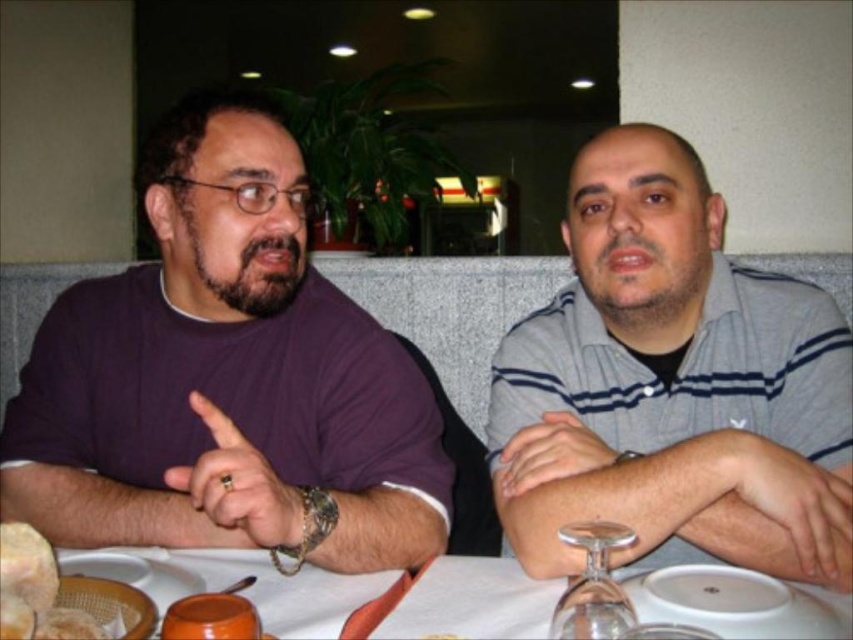
Question: Which point appears closest to the camera in this image?

Choices:
 (A) (273, 428)
 (B) (585, 616)

Answer: (B)

Question: Does purple matte shirt at left appear on the left side of transparent glass wine glass at lower center?

Choices:
 (A) yes
 (B) no

Answer: (A)

Question: Considering the real-world distances, which object is farthest from the transparent glass wine glass at lower center?

Choices:
 (A) white glossy table at lower center
 (B) bread soft at lower left

Answer: (B)

Question: From the image, what is the correct spatial relationship of gray striped shirt at right in relation to white glossy table at lower center?

Choices:
 (A) below
 (B) above

Answer: (B)

Question: In this image, where is purple matte shirt at left located relative to gray striped shirt at right?

Choices:
 (A) above
 (B) below

Answer: (B)

Question: Which point is closer to the camera?

Choices:
 (A) (444, 563)
 (B) (1, 572)

Answer: (B)